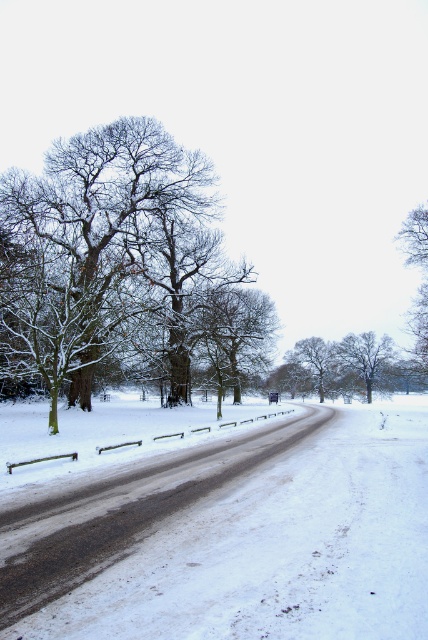
Does point (183, 529) lie behind point (329, 364)?

No, it is not.

Can you confirm if white powdery snow at center is positioned to the left of snow-covered tree at center?

Indeed, white powdery snow at center is positioned on the left side of snow-covered tree at center.

This screenshot has width=428, height=640. Describe the element at coordinates (279, 548) in the screenshot. I see `white powdery snow at center` at that location.

Where is `white powdery snow at center`? This screenshot has width=428, height=640. white powdery snow at center is located at coordinates (279, 548).

Does point (91, 376) come in front of point (258, 314)?

Yes, it is in front of point (258, 314).

Can you confirm if snow-covered bark tree at upper left is positioned to the right of snowy bare tree at center?

In fact, snow-covered bark tree at upper left is to the left of snowy bare tree at center.

Between point (86, 227) and point (228, 289), which one is positioned behind?

Positioned behind is point (228, 289).

Locate an element on the screen. This screenshot has height=640, width=428. snow-covered bark tree at upper left is located at coordinates (89, 248).

Can you confirm if white powdery snow at center is wider than snow-covered bark tree at upper left?

In fact, white powdery snow at center might be narrower than snow-covered bark tree at upper left.

Between white powdery snow at center and snow-covered bark tree at upper left, which one has less height?

white powdery snow at center is shorter.

Image resolution: width=428 pixels, height=640 pixels. Describe the element at coordinates (279, 548) in the screenshot. I see `white powdery snow at center` at that location.

The height and width of the screenshot is (640, 428). In order to click on white powdery snow at center in this screenshot , I will do `click(279, 548)`.